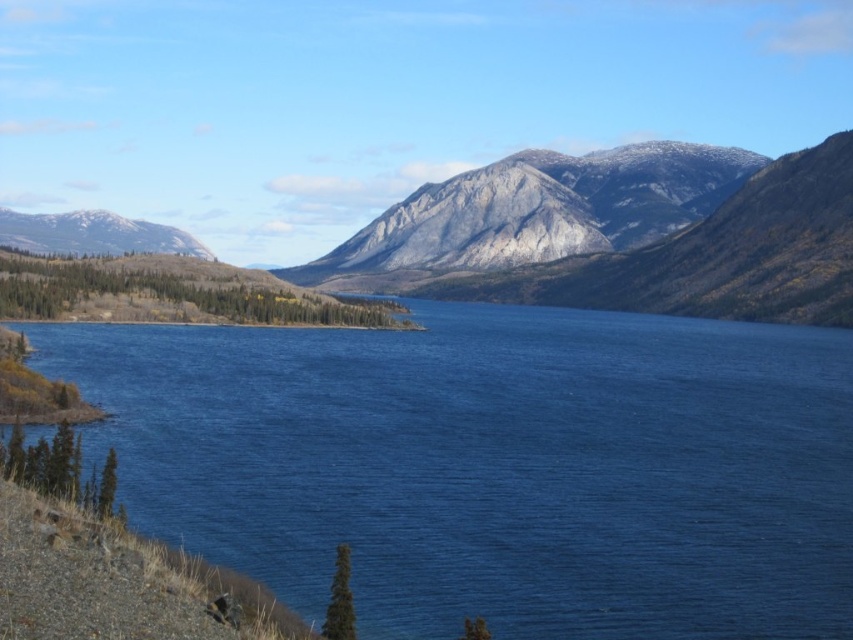
You are standing at the lakeside and want to take a photo of both the blue liquid water at center and the gray rocky mountain at left. Which object should you frame first in your camera to ensure both are captured in the same shot?

The blue liquid water at center is smaller than the gray rocky mountain at left, so you should frame the gray rocky mountain at left first to ensure both fit in the shot.